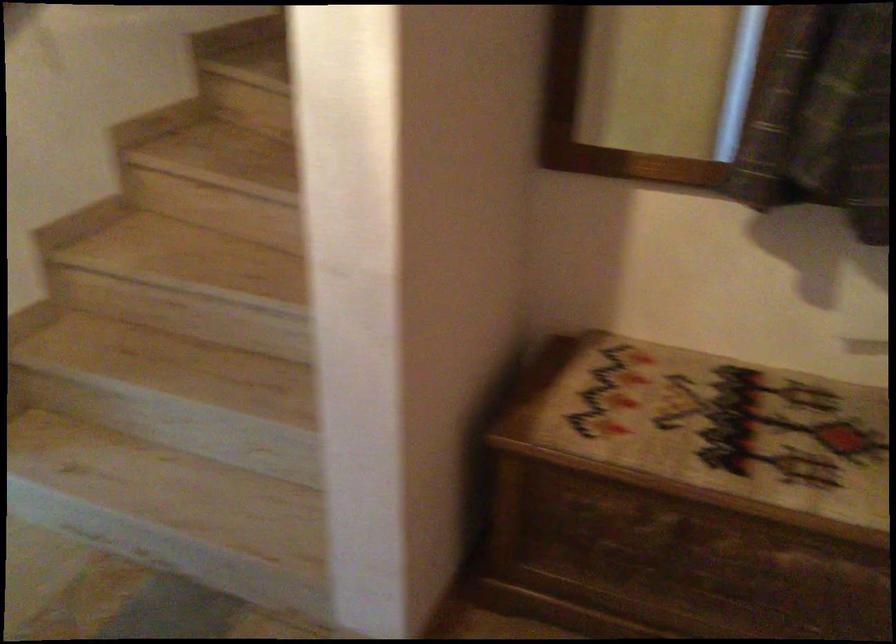
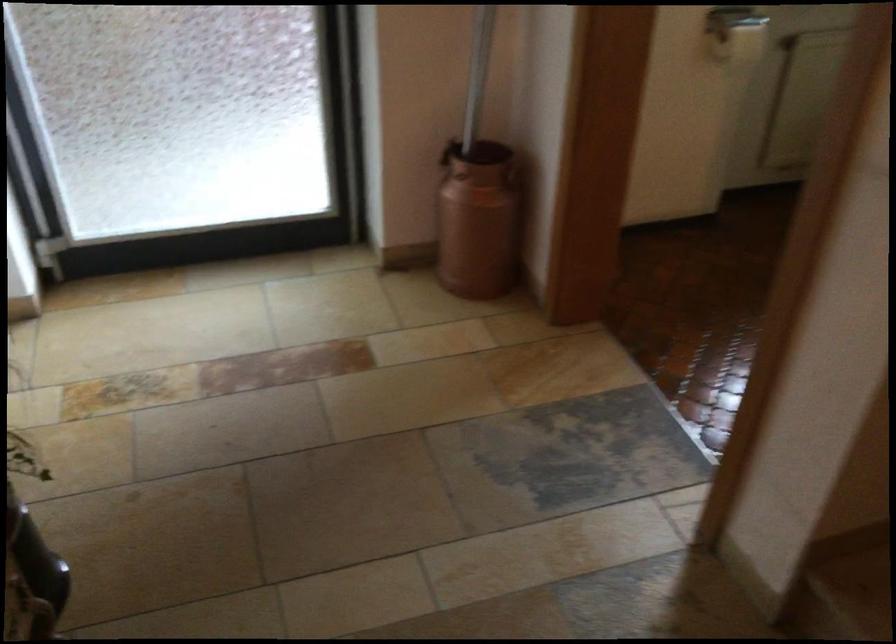
Question: How did the camera likely rotate?

Choices:
 (A) Left
 (B) Right
 (C) Up
 (D) Down

Answer: (A)